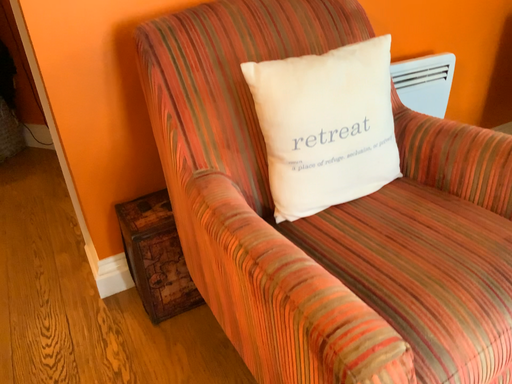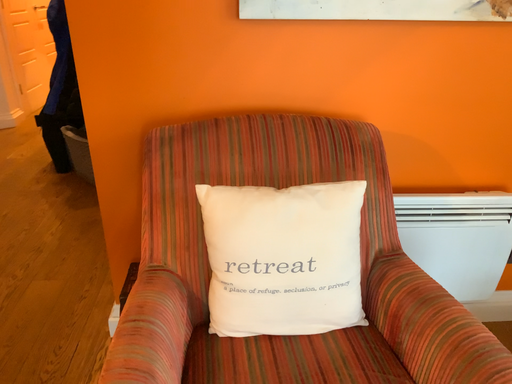
Question: How did the camera likely rotate when shooting the video?

Choices:
 (A) rotated left
 (B) rotated right

Answer: (A)